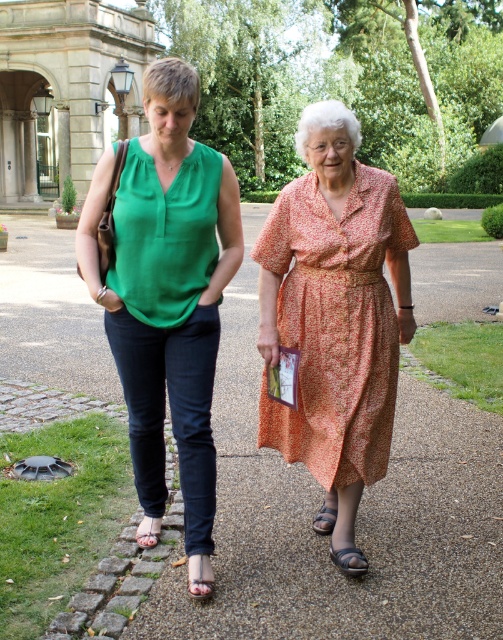
Question: Is printed cotton dress at center behind leather sandal at lower center?

Choices:
 (A) yes
 (B) no

Answer: (A)

Question: Which object appears farthest from the camera in this image?

Choices:
 (A) metallic gray sandal at lower center
 (B) leather sandal at lower center
 (C) brown leather sandal at lower center

Answer: (C)

Question: Can you confirm if brown gravel pavement at center is positioned below brown leather sandal at lower center?

Choices:
 (A) no
 (B) yes

Answer: (A)

Question: Is brown gravel pavement at center to the right of brown leather sandal at lower center from the viewer's perspective?

Choices:
 (A) yes
 (B) no

Answer: (B)

Question: Which object appears farthest from the camera in this image?

Choices:
 (A) brown leather sandal at lower center
 (B) leather sandal at lower center

Answer: (A)

Question: Which object is farther from the camera taking this photo?

Choices:
 (A) leather sandal at lower center
 (B) matte orange dress at center
 (C) metallic gray sandal at lower center

Answer: (C)